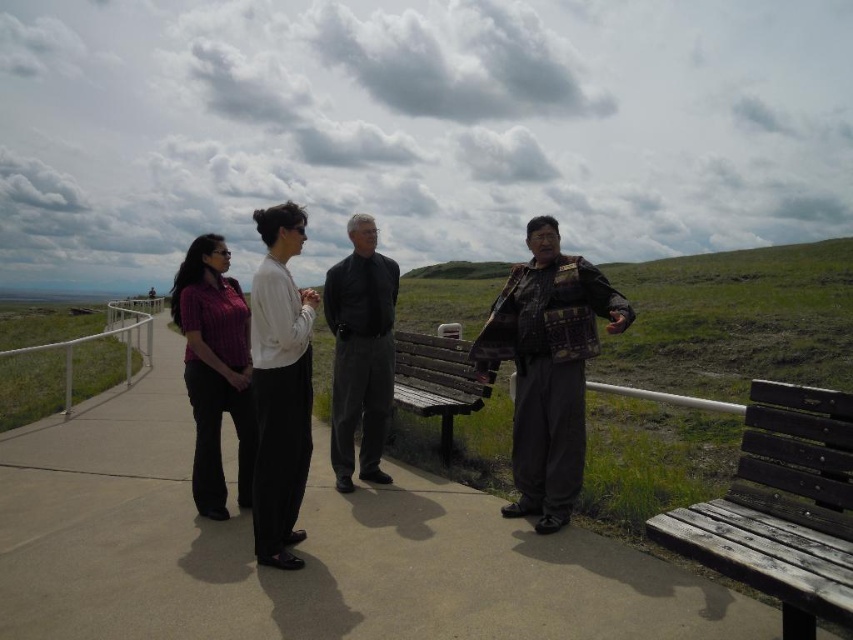
Question: Which of these objects is positioned farthest from the wooden bench at center?

Choices:
 (A) plaid fabric jacket at center
 (B) dark gray fabric pants at center
 (C) white matte shirt at center

Answer: (C)

Question: Is weathered wood bench at lower right wider than plaid fabric jacket at center?

Choices:
 (A) yes
 (B) no

Answer: (B)

Question: From the image, what is the correct spatial relationship of weathered wood bench at lower right in relation to dark gray fabric pants at center?

Choices:
 (A) left
 (B) right

Answer: (B)

Question: Estimate the real-world distances between objects in this image. Which object is farther from the weathered wood bench at lower right?

Choices:
 (A) plaid fabric jacket at center
 (B) dark gray fabric pants at center
 (C) dark brown wooden bench at center

Answer: (B)

Question: Which object is positioned farthest from the wooden bench at center?

Choices:
 (A) dark gray fabric pants at center
 (B) white matte shirt at center
 (C) matte purple shirt at left

Answer: (C)

Question: Is plaid fabric jacket at center behind dark gray fabric pants at center?

Choices:
 (A) yes
 (B) no

Answer: (B)